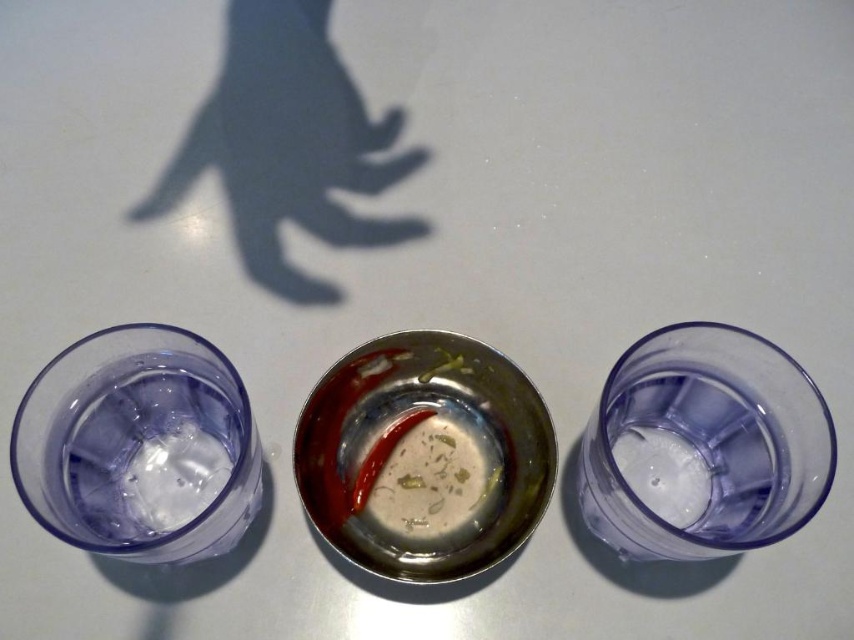
You are setting up a small table for a party and need to arrange the transparent plastic shot glass at center right and the transparent plastic shot glass at left. If you want to place a taller object between them, which side should you choose?

You should place the taller object next to the transparent plastic shot glass at left because it is taller than the transparent plastic shot glass at center right.

Based on the photo, please provide the coordinates of the transparent plastic shot glass at center right in the image. The coordinate system has the origin at the bottom left corner of the image, with the x and y axes increasing to the right and up respectively.

The transparent plastic shot glass at center right is located at coordinates point (703, 445).

You are standing in front of the table and want to reach for the two points marked on the objects. Which point, point at (670, 474) or point at (168, 394), is closer to you?

Point at (670, 474) is closer to you because it is further to the viewer than point at (168, 394).